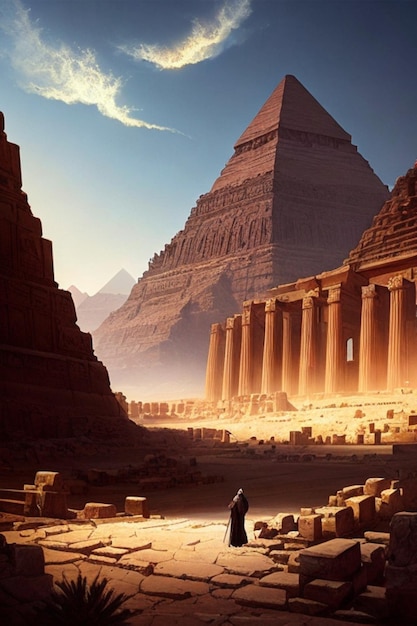
This screenshot has width=417, height=626. I want to click on window, so click(342, 361).